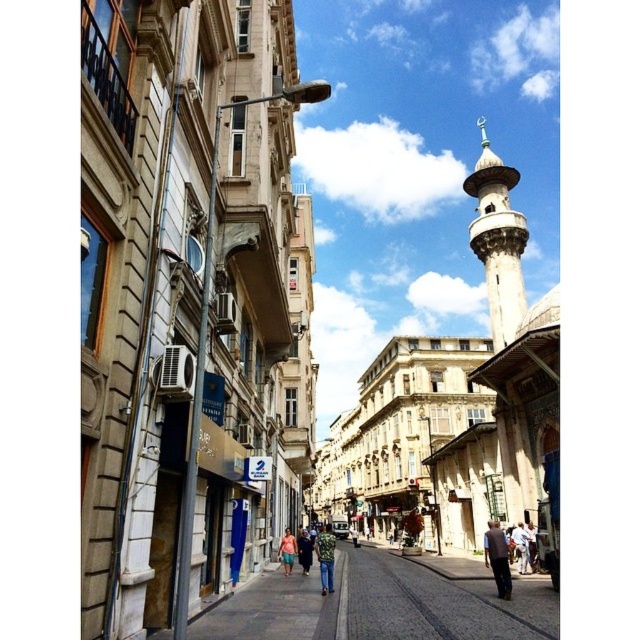
Question: Is white marble minaret at upper right wider than light pink fabric dress at center?

Choices:
 (A) yes
 (B) no

Answer: (A)

Question: Which point is farther from the camera taking this photo?

Choices:
 (A) (285, 541)
 (B) (330, 570)
 (C) (513, 282)

Answer: (C)

Question: Estimate the real-world distances between objects in this image. Which object is farther from the denim pants at center?

Choices:
 (A) pink fabric dress at center
 (B) light pink fabric dress at center
 (C) white marble minaret at upper right

Answer: (C)

Question: Does denim pants at center have a larger size compared to light pink fabric dress at center?

Choices:
 (A) yes
 (B) no

Answer: (A)

Question: Which of the following is the farthest from the observer?

Choices:
 (A) (497, 525)
 (B) (524, 545)
 (C) (285, 573)
 (D) (308, 552)

Answer: (D)

Question: Is dark brown leather jacket at center below light pink fabric dress at center?

Choices:
 (A) yes
 (B) no

Answer: (B)